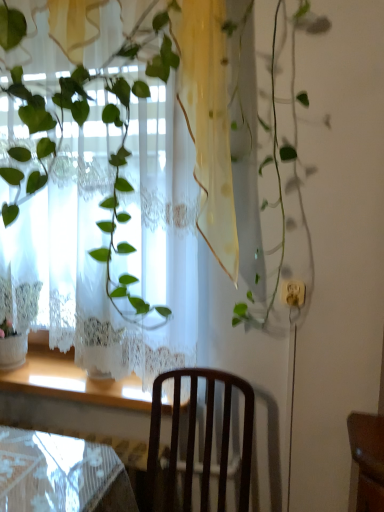
Question: Is wooden at lower left positioned far away from white lace curtain at upper left?

Choices:
 (A) yes
 (B) no

Answer: (B)

Question: From a real-world perspective, is wooden at lower left over white lace curtain at upper left?

Choices:
 (A) no
 (B) yes

Answer: (A)

Question: Can you confirm if wooden at lower left is wider than white lace curtain at upper left?

Choices:
 (A) yes
 (B) no

Answer: (A)

Question: Is wooden at lower left next to white lace curtain at upper left?

Choices:
 (A) no
 (B) yes

Answer: (A)

Question: Does wooden at lower left lie behind white lace curtain at upper left?

Choices:
 (A) no
 (B) yes

Answer: (B)

Question: From the image's perspective, is wooden at lower left located above white lace curtain at upper left?

Choices:
 (A) no
 (B) yes

Answer: (A)

Question: From the image's perspective, is dark wood chair at center located beneath white lace curtain at upper left?

Choices:
 (A) yes
 (B) no

Answer: (A)

Question: Is dark wood chair at center oriented towards white lace curtain at upper left?

Choices:
 (A) yes
 (B) no

Answer: (B)

Question: Is dark wood chair at center at the right side of white lace curtain at upper left?

Choices:
 (A) yes
 (B) no

Answer: (A)

Question: Can we say dark wood chair at center lies outside white lace curtain at upper left?

Choices:
 (A) no
 (B) yes

Answer: (B)

Question: From a real-world perspective, does dark wood chair at center sit lower than white lace curtain at upper left?

Choices:
 (A) no
 (B) yes

Answer: (B)

Question: Considering the relative sizes of dark wood chair at center and white lace curtain at upper left in the image provided, is dark wood chair at center shorter than white lace curtain at upper left?

Choices:
 (A) yes
 (B) no

Answer: (A)

Question: From a real-world perspective, is white lace curtain at upper left positioned over wooden at lower left based on gravity?

Choices:
 (A) yes
 (B) no

Answer: (A)